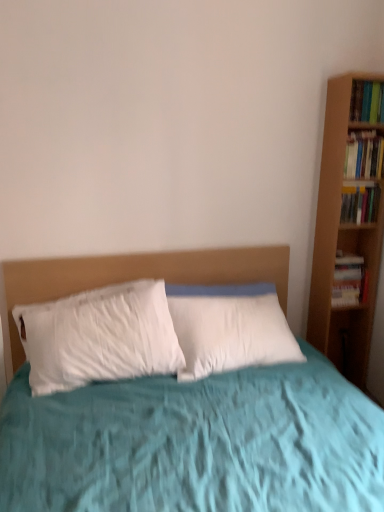
In order to click on empty space that is ontop of hardcover book at right, arranged as the fourth book when viewed from the top (from a real-world perspective) in this screenshot , I will do `click(347, 256)`.